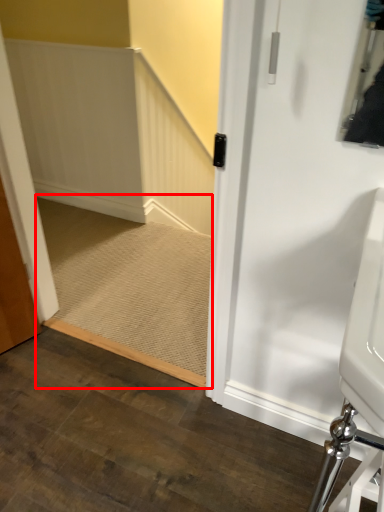
Question: From the image's perspective, what is the correct spatial relationship of stairs (annotated by the red box) in relation to sink?

Choices:
 (A) above
 (B) below

Answer: (A)